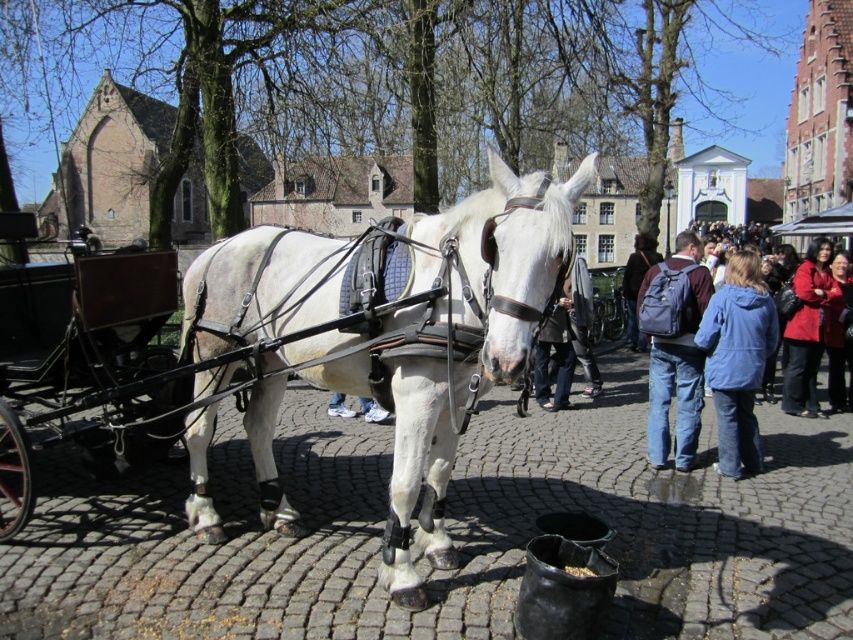
Does white matte/suede horse at center have a larger size compared to dark brown backpack at center?

No, white matte/suede horse at center is not bigger than dark brown backpack at center.

Does point (422, 342) lie behind point (635, 305)?

No.

Does point (483, 358) lie behind point (633, 340)?

No, it is in front of (633, 340).

Locate an element on the screen. The height and width of the screenshot is (640, 853). white matte/suede horse at center is located at coordinates (393, 332).

Does point (68, 372) come closer to viewer compared to point (792, 365)?

Yes.

Looking at this image, can you confirm if wooden cart at left is smaller than red leather jacket at right?

No, wooden cart at left is not smaller than red leather jacket at right.

Is point (120, 451) behind point (802, 292)?

No, (120, 451) is in front of (802, 292).

Where is `wooden cart at left`? wooden cart at left is located at coordinates (91, 376).

Can you confirm if white matte/suede horse at center is positioned above red leather jacket at right?

No, white matte/suede horse at center is not above red leather jacket at right.

Who is higher up, white matte/suede horse at center or red leather jacket at right?

Positioned higher is red leather jacket at right.

Is point (283, 504) closer to viewer compared to point (798, 328)?

Yes, it is in front of point (798, 328).

At what (x,y) coordinates should I click in order to perform the action: click on white matte/suede horse at center. Please return your answer as a coordinate pair (x, y). The height and width of the screenshot is (640, 853). Looking at the image, I should click on (393, 332).